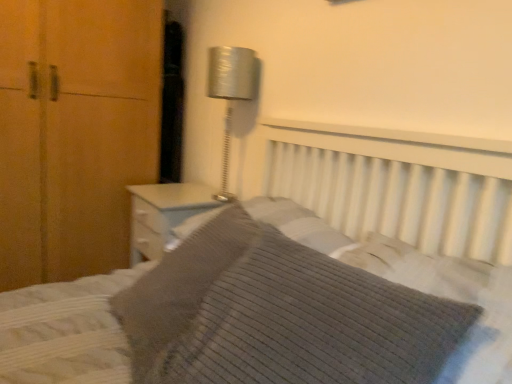
Question: Does knitted gray pillow at center, the 2th pillow when ordered from front to back, have a greater width compared to knitted fabric bed at center?

Choices:
 (A) no
 (B) yes

Answer: (A)

Question: Is knitted gray pillow at center, the 2th pillow when ordered from front to back, next to knitted fabric bed at center?

Choices:
 (A) no
 (B) yes

Answer: (A)

Question: Is knitted gray pillow at center, marked as the 1th pillow in a back-to-front arrangement, bigger than knitted fabric bed at center?

Choices:
 (A) yes
 (B) no

Answer: (B)

Question: Does knitted gray pillow at center, marked as the 1th pillow in a back-to-front arrangement, appear on the left side of knitted fabric bed at center?

Choices:
 (A) no
 (B) yes

Answer: (B)

Question: Would you consider knitted gray pillow at center, marked as the 1th pillow in a back-to-front arrangement, to be distant from knitted fabric bed at center?

Choices:
 (A) no
 (B) yes

Answer: (A)

Question: Is knitted gray pillow at center, marked as the 1th pillow in a back-to-front arrangement, taller than knitted fabric bed at center?

Choices:
 (A) no
 (B) yes

Answer: (A)

Question: Is metallic silver lamp at upper center next to knitted gray pillow at center, the 2th pillow when ordered from front to back?

Choices:
 (A) yes
 (B) no

Answer: (B)

Question: Can you confirm if metallic silver lamp at upper center is smaller than knitted gray pillow at center, the 2th pillow when ordered from front to back?

Choices:
 (A) yes
 (B) no

Answer: (A)

Question: Does metallic silver lamp at upper center lie in front of knitted gray pillow at center, the 2th pillow when ordered from front to back?

Choices:
 (A) yes
 (B) no

Answer: (B)

Question: From a real-world perspective, is metallic silver lamp at upper center beneath knitted gray pillow at center, marked as the 1th pillow in a back-to-front arrangement?

Choices:
 (A) no
 (B) yes

Answer: (A)

Question: Considering the relative positions of metallic silver lamp at upper center and knitted gray pillow at center, the 2th pillow when ordered from front to back, in the image provided, is metallic silver lamp at upper center behind knitted gray pillow at center, the 2th pillow when ordered from front to back,?

Choices:
 (A) no
 (B) yes

Answer: (B)

Question: From the image's perspective, does metallic silver lamp at upper center appear lower than knitted gray pillow at center, marked as the 1th pillow in a back-to-front arrangement?

Choices:
 (A) no
 (B) yes

Answer: (A)

Question: Does knitted fabric bed at center come behind knitted gray pillow at center, marked as the 1th pillow in a back-to-front arrangement?

Choices:
 (A) no
 (B) yes

Answer: (A)